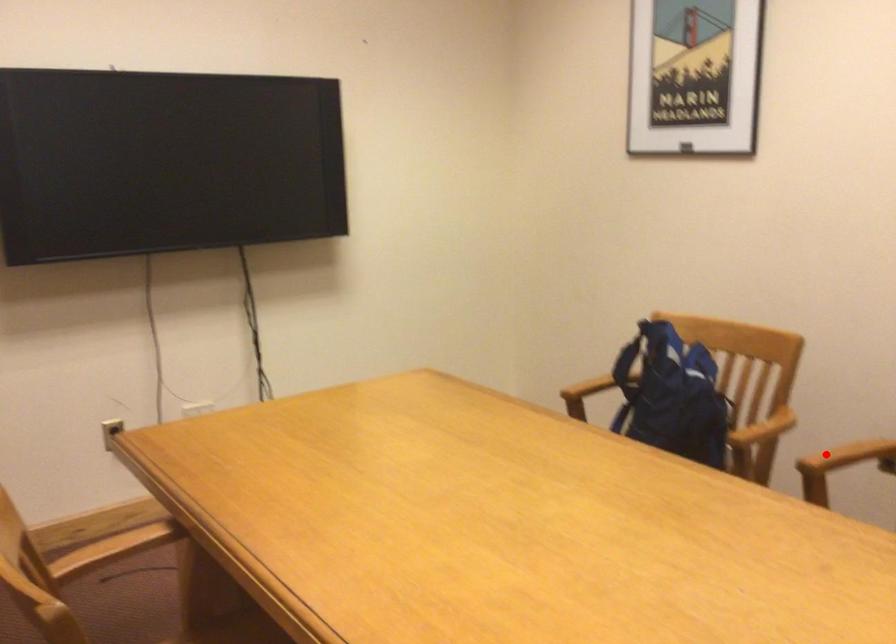
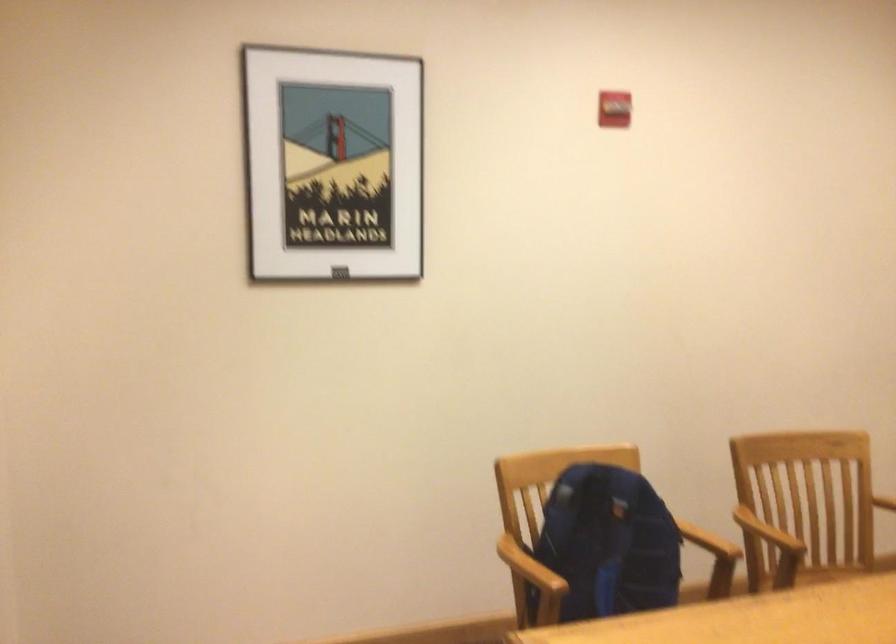
Where in the second image is the point corresponding to the highlighted location from the first image?

(767, 532)